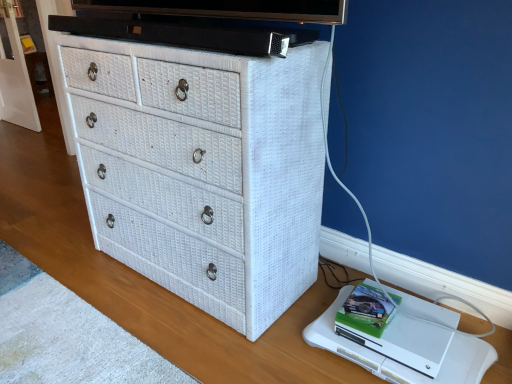
Where is `vacant area situated to the left side of white wicker chest of drawers at center`? Image resolution: width=512 pixels, height=384 pixels. vacant area situated to the left side of white wicker chest of drawers at center is located at coordinates (68, 249).